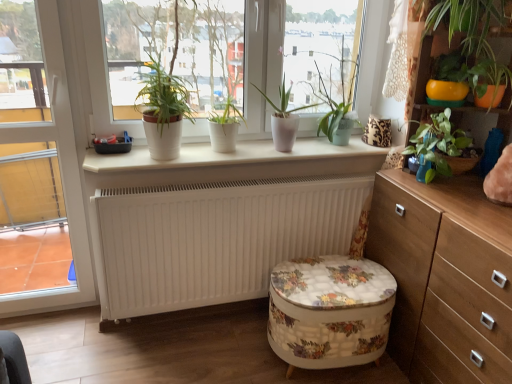
Identify the location of free space between pink ceramic plant pot at center, the 3th houseplant when ordered from left to right, and white matte pot at center, acting as the 4th houseplant starting from the right. (240, 155).